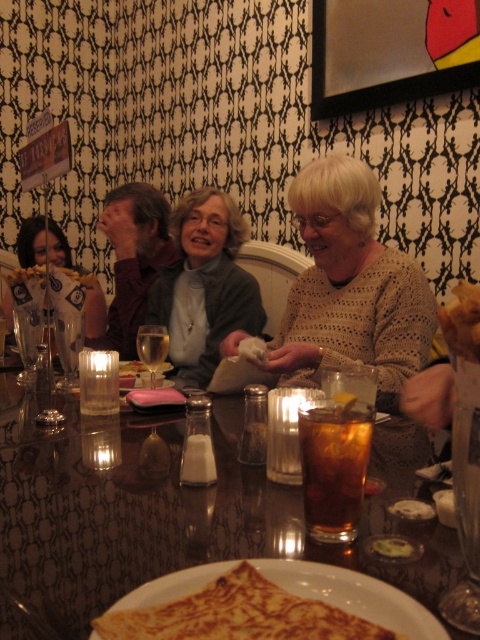
Question: Which point is closer to the camera?

Choices:
 (A) golden crispy chicken at center
 (B) translucent glass drink at center
 (C) translucent glass at table center

Answer: (A)

Question: In this image, where is shiny glass table at center located relative to golden-brown crepe at center?

Choices:
 (A) left
 (B) right

Answer: (A)

Question: Which object is closer to the camera taking this photo?

Choices:
 (A) matte gray sweater at center
 (B) translucent glass drink at center

Answer: (B)

Question: Is golden-brown crepe at center wider than matte black shirt at upper left?

Choices:
 (A) yes
 (B) no

Answer: (B)

Question: Can you confirm if knitted beige sweater at center is bigger than golden-brown crepe at center?

Choices:
 (A) yes
 (B) no

Answer: (A)

Question: Estimate the real-world distances between objects in this image. Which object is farther from the matte gray sweater at center?

Choices:
 (A) matte black shirt at upper left
 (B) golden crispy chicken at center

Answer: (B)